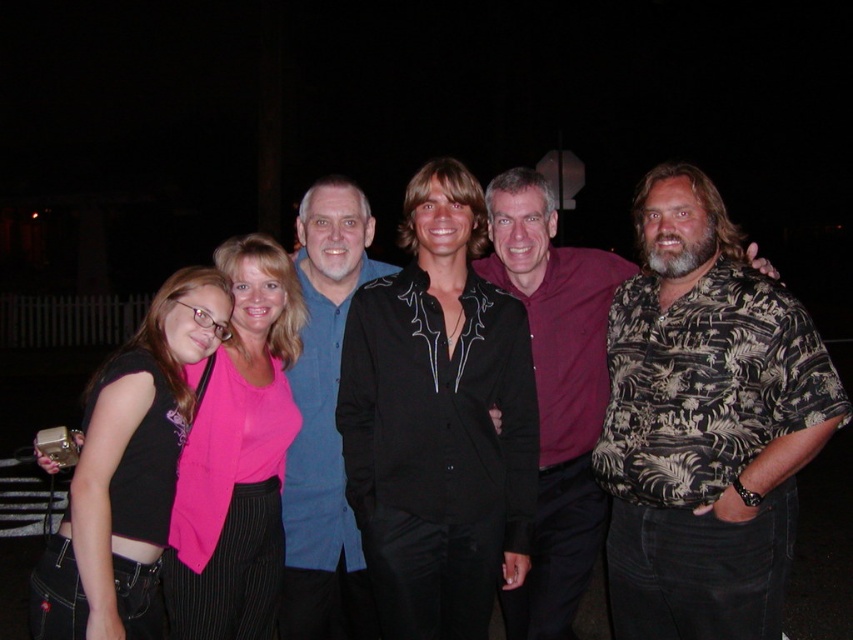
Question: Which of the following is the closest to the observer?

Choices:
 (A) pink fabric top at center
 (B) blue denim shirt at center
 (C) black satin shirt at center

Answer: (C)

Question: Which of the following is the closest to the observer?

Choices:
 (A) blue denim shirt at center
 (B) printed fabric shirt at center
 (C) black satin shirt at center
 (D) pink fabric top at center

Answer: (B)

Question: Which of the following is the farthest from the observer?

Choices:
 (A) printed fabric shirt at center
 (B) black fabric shirt at left
 (C) pink fabric top at center

Answer: (C)

Question: Does black satin shirt at center have a lesser width compared to pink fabric top at center?

Choices:
 (A) no
 (B) yes

Answer: (A)

Question: Is printed fabric shirt at center above pink fabric top at center?

Choices:
 (A) no
 (B) yes

Answer: (B)

Question: Does black satin shirt at center have a smaller size compared to black satin blouse at center?

Choices:
 (A) no
 (B) yes

Answer: (A)